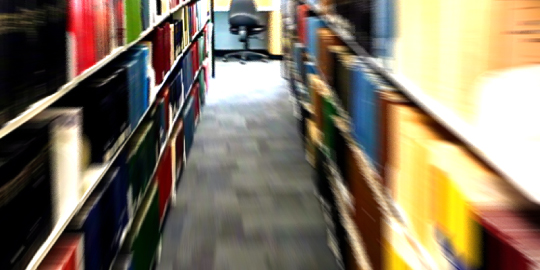
Where is `books`? books is located at coordinates (111, 36), (143, 78), (144, 162), (364, 115), (405, 54), (334, 172).